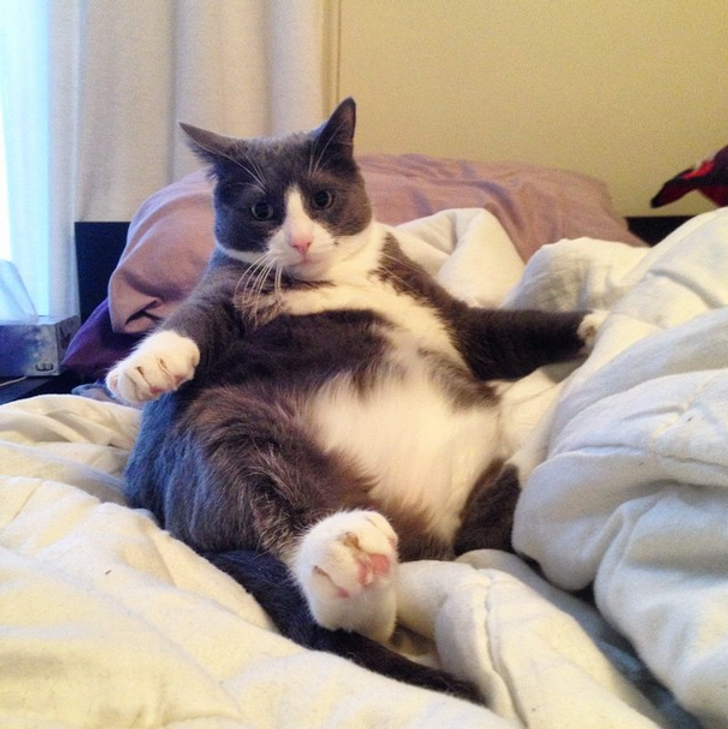
This screenshot has width=728, height=729. Identify the location of box. (22, 343).